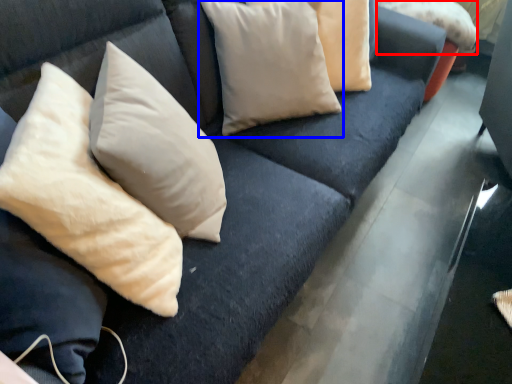
Question: Among these objects, which one is nearest to the camera, pillow (highlighted by a red box) or pillow (highlighted by a blue box)?

Choices:
 (A) pillow
 (B) pillow

Answer: (B)